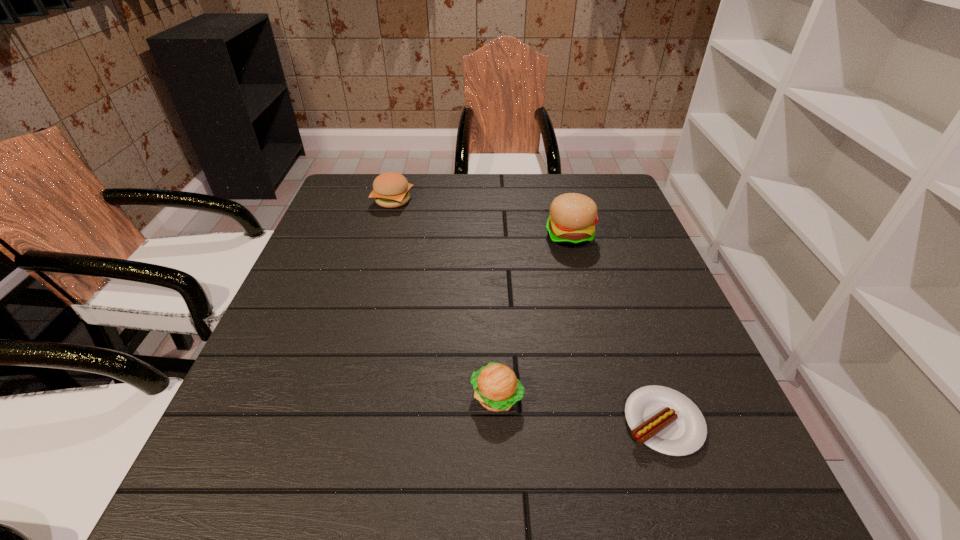
Image resolution: width=960 pixels, height=540 pixels. What are the coordinates of `free space located 0.370m on the back of the sausage` in the screenshot? It's located at (607, 259).

I want to click on object that is at the far edge, so click(x=391, y=190).

The width and height of the screenshot is (960, 540). Find the location of `object located at the left edge`. object located at the left edge is located at coordinates point(391,190).

The width and height of the screenshot is (960, 540). Find the location of `hamburger present at the right edge`. hamburger present at the right edge is located at coordinates (573, 216).

You are a GUI agent. You are given a task and a screenshot of the screen. Output one action in this format:
    pyautogui.click(x=<x>, y=<y>)
    Task: Click on the sausage situated at the right edge
    
    Given the screenshot: What is the action you would take?
    click(665, 420)

This screenshot has height=540, width=960. What are the coordinates of `object that is at the far left corner` in the screenshot? It's located at (391, 190).

In the image, there is a desktop. In order to click on vacant space at the far edge in this screenshot , I will do `click(432, 215)`.

What are the coordinates of `vacant region at the near edge of the desktop` in the screenshot? It's located at (350, 504).

I want to click on vacant area at the left edge, so click(378, 219).

This screenshot has height=540, width=960. In order to click on vacant space at the right edge in this screenshot , I will do `click(606, 229)`.